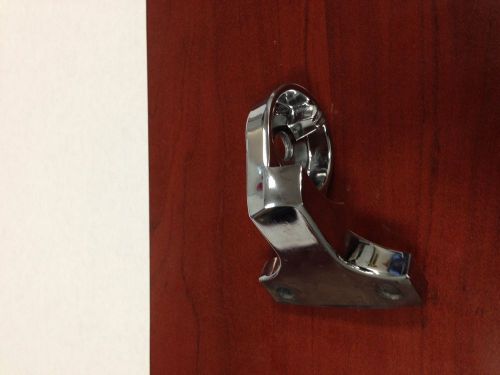
The image size is (500, 375). What are the coordinates of `wall` in the screenshot? It's located at (72, 195).